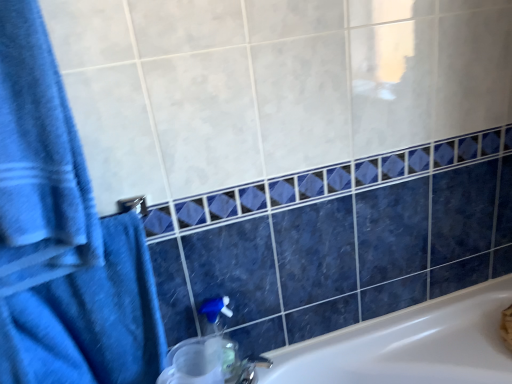
At what (x,y) coordinates should I click in order to perform the action: click on blue fabric towel at left, arranged as the first bath towel when ordered from the bottom. Please return your answer as a coordinate pair (x, y). Looking at the image, I should click on (89, 319).

The width and height of the screenshot is (512, 384). What do you see at coordinates (221, 335) in the screenshot? I see `translucent plastic soap dispenser at lower center` at bounding box center [221, 335].

Image resolution: width=512 pixels, height=384 pixels. I want to click on blue cotton towel at left, the 2th bath towel in the bottom-to-top sequence, so click(x=62, y=237).

Is blue fabric towel at left, arranged as the first bath towel when ordered from the bottom, in contact with blue cotton towel at left, the 2th bath towel in the bottom-to-top sequence?

Indeed, blue fabric towel at left, arranged as the first bath towel when ordered from the bottom, and blue cotton towel at left, the 2th bath towel in the bottom-to-top sequence, are beside each other and touching.

Is blue fabric towel at left, arranged as the first bath towel when ordered from the bottom, turned away from blue cotton towel at left, the 1th bath towel in the top-to-bottom sequence?

No, blue fabric towel at left, arranged as the first bath towel when ordered from the bottom, is not facing the opposite direction of blue cotton towel at left, the 1th bath towel in the top-to-bottom sequence.

Can you tell me how much blue fabric towel at left, arranged as the first bath towel when ordered from the bottom, and blue cotton towel at left, the 2th bath towel in the bottom-to-top sequence, differ in facing direction?

2.48e-05 degrees separate the facing orientations of blue fabric towel at left, arranged as the first bath towel when ordered from the bottom, and blue cotton towel at left, the 2th bath towel in the bottom-to-top sequence.

Does point (19, 320) come in front of point (80, 313)?

Yes, it is.

Which of these two, blue cotton towel at left, the 1th bath towel in the top-to-bottom sequence, or blue fabric towel at left, arranged as the first bath towel when ordered from the bottom, is thinner?

With smaller width is blue cotton towel at left, the 1th bath towel in the top-to-bottom sequence.

From a real-world perspective, which is physically above, blue cotton towel at left, the 2th bath towel in the bottom-to-top sequence, or blue fabric towel at left, which is counted as the 2th bath towel, starting from the top?

blue cotton towel at left, the 2th bath towel in the bottom-to-top sequence, is physically above.

Is blue cotton towel at left, the 2th bath towel in the bottom-to-top sequence, positioned beyond the bounds of blue fabric towel at left, which is counted as the 2th bath towel, starting from the top?

Absolutely, blue cotton towel at left, the 2th bath towel in the bottom-to-top sequence, is external to blue fabric towel at left, which is counted as the 2th bath towel, starting from the top.

Is blue cotton towel at left, the 1th bath towel in the top-to-bottom sequence, in front of or behind blue fabric towel at left, which is counted as the 2th bath towel, starting from the top, in the image?

Visually, blue cotton towel at left, the 1th bath towel in the top-to-bottom sequence, is located in front of blue fabric towel at left, which is counted as the 2th bath towel, starting from the top.

Is translucent plastic soap dispenser at lower center aimed at blue fabric towel at left, arranged as the first bath towel when ordered from the bottom?

No.

How many degrees apart are the facing directions of translucent plastic soap dispenser at lower center and blue fabric towel at left, which is counted as the 2th bath towel, starting from the top?

translucent plastic soap dispenser at lower center and blue fabric towel at left, which is counted as the 2th bath towel, starting from the top, are facing 1.01 degrees away from each other.

Between translucent plastic soap dispenser at lower center and blue fabric towel at left, which is counted as the 2th bath towel, starting from the top, which one has larger width?

With larger width is blue fabric towel at left, which is counted as the 2th bath towel, starting from the top.

From the image's perspective, which bath towel is the 1st one above the translucent plastic soap dispenser at lower center? Please provide its 2D coordinates.

[(89, 319)]

Is blue cotton towel at left, the 2th bath towel in the bottom-to-top sequence, far away from translucent plastic soap dispenser at lower center?

No, blue cotton towel at left, the 2th bath towel in the bottom-to-top sequence, is not far away from translucent plastic soap dispenser at lower center.

Which of these two, blue cotton towel at left, the 2th bath towel in the bottom-to-top sequence, or translucent plastic soap dispenser at lower center, stands taller?

Standing taller between the two is blue cotton towel at left, the 2th bath towel in the bottom-to-top sequence.

From the image's perspective, is blue cotton towel at left, the 2th bath towel in the bottom-to-top sequence, beneath translucent plastic soap dispenser at lower center?

Actually, blue cotton towel at left, the 2th bath towel in the bottom-to-top sequence, appears above translucent plastic soap dispenser at lower center in the image.

Which is further, (68, 344) or (208, 311)?

The point (208, 311) is behind.

Is blue fabric towel at left, arranged as the first bath towel when ordered from the bottom, wider or thinner than translucent plastic soap dispenser at lower center?

Clearly, blue fabric towel at left, arranged as the first bath towel when ordered from the bottom, has more width compared to translucent plastic soap dispenser at lower center.

From a real-world perspective, which object rests below the other?

translucent plastic soap dispenser at lower center, from a real-world perspective.

In the scene shown: From the image's perspective, is blue fabric towel at left, which is counted as the 2th bath towel, starting from the top, positioned above or below translucent plastic soap dispenser at lower center?

blue fabric towel at left, which is counted as the 2th bath towel, starting from the top, is situated higher than translucent plastic soap dispenser at lower center in the image.

Is blue fabric towel at left, arranged as the first bath towel when ordered from the bottom, not within translucent plastic soap dispenser at lower center?

blue fabric towel at left, arranged as the first bath towel when ordered from the bottom, is positioned outside translucent plastic soap dispenser at lower center.

How far apart are translucent plastic soap dispenser at lower center and blue cotton towel at left, the 2th bath towel in the bottom-to-top sequence?

They are 15.04 inches apart.

Is point (213, 319) more distant than point (30, 366)?

Yes, point (213, 319) is behind point (30, 366).

From the image's perspective, is translucent plastic soap dispenser at lower center positioned above or below blue cotton towel at left, the 2th bath towel in the bottom-to-top sequence?

translucent plastic soap dispenser at lower center is situated lower than blue cotton towel at left, the 2th bath towel in the bottom-to-top sequence, in the image.

Which of these two, translucent plastic soap dispenser at lower center or blue cotton towel at left, the 1th bath towel in the top-to-bottom sequence, is bigger?

With larger size is blue cotton towel at left, the 1th bath towel in the top-to-bottom sequence.

The width and height of the screenshot is (512, 384). Identify the location of bath towel behind the blue cotton towel at left, the 2th bath towel in the bottom-to-top sequence. (89, 319).

Locate an element on the screen. bath towel lying on the left of blue fabric towel at left, which is counted as the 2th bath towel, starting from the top is located at coordinates (62, 237).

Based on their spatial positions, is translucent plastic soap dispenser at lower center or blue fabric towel at left, which is counted as the 2th bath towel, starting from the top, closer to blue cotton towel at left, the 1th bath towel in the top-to-bottom sequence?

blue fabric towel at left, which is counted as the 2th bath towel, starting from the top.

Looking at the image, which one is located further to blue fabric towel at left, which is counted as the 2th bath towel, starting from the top, translucent plastic soap dispenser at lower center or blue cotton towel at left, the 2th bath towel in the bottom-to-top sequence?

translucent plastic soap dispenser at lower center is positioned further to the anchor blue fabric towel at left, which is counted as the 2th bath towel, starting from the top.

From the image, which object appears to be nearer to translucent plastic soap dispenser at lower center, blue cotton towel at left, the 1th bath towel in the top-to-bottom sequence, or blue fabric towel at left, arranged as the first bath towel when ordered from the bottom?

blue fabric towel at left, arranged as the first bath towel when ordered from the bottom, lies closer to translucent plastic soap dispenser at lower center than the other object.

From the image, which object appears to be farther from blue fabric towel at left, arranged as the first bath towel when ordered from the bottom, blue cotton towel at left, the 1th bath towel in the top-to-bottom sequence, or translucent plastic soap dispenser at lower center?

translucent plastic soap dispenser at lower center is further to blue fabric towel at left, arranged as the first bath towel when ordered from the bottom.

Consider the image. Considering their positions, is blue fabric towel at left, which is counted as the 2th bath towel, starting from the top, positioned closer to translucent plastic soap dispenser at lower center than blue cotton towel at left, the 2th bath towel in the bottom-to-top sequence?

blue fabric towel at left, which is counted as the 2th bath towel, starting from the top.

Considering their positions, is blue fabric towel at left, arranged as the first bath towel when ordered from the bottom, positioned closer to blue cotton towel at left, the 1th bath towel in the top-to-bottom sequence, than translucent plastic soap dispenser at lower center?

Among the two, blue fabric towel at left, arranged as the first bath towel when ordered from the bottom, is located nearer to blue cotton towel at left, the 1th bath towel in the top-to-bottom sequence.

What are the coordinates of `bath towel that lies between blue cotton towel at left, the 1th bath towel in the top-to-bottom sequence, and translucent plastic soap dispenser at lower center from top to bottom` in the screenshot? It's located at (89, 319).